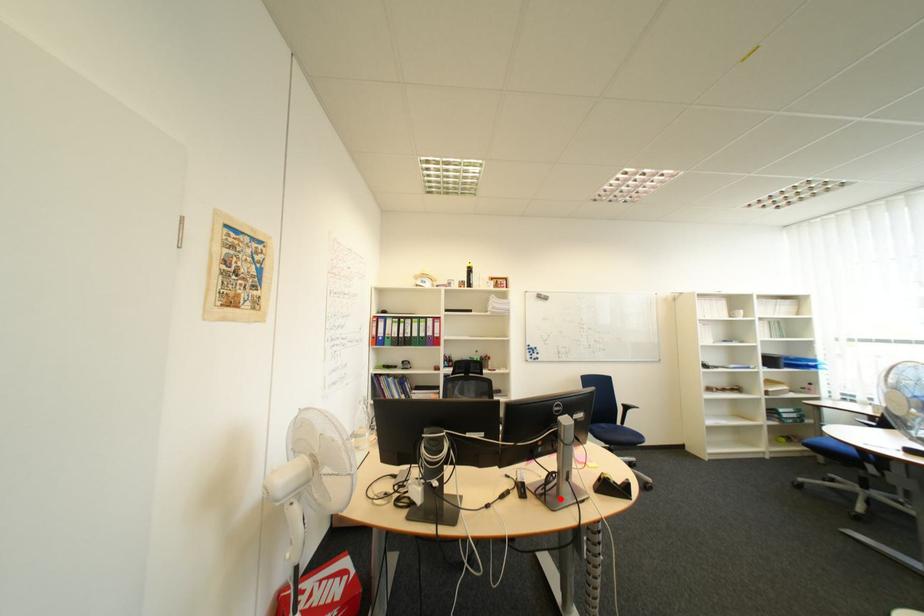
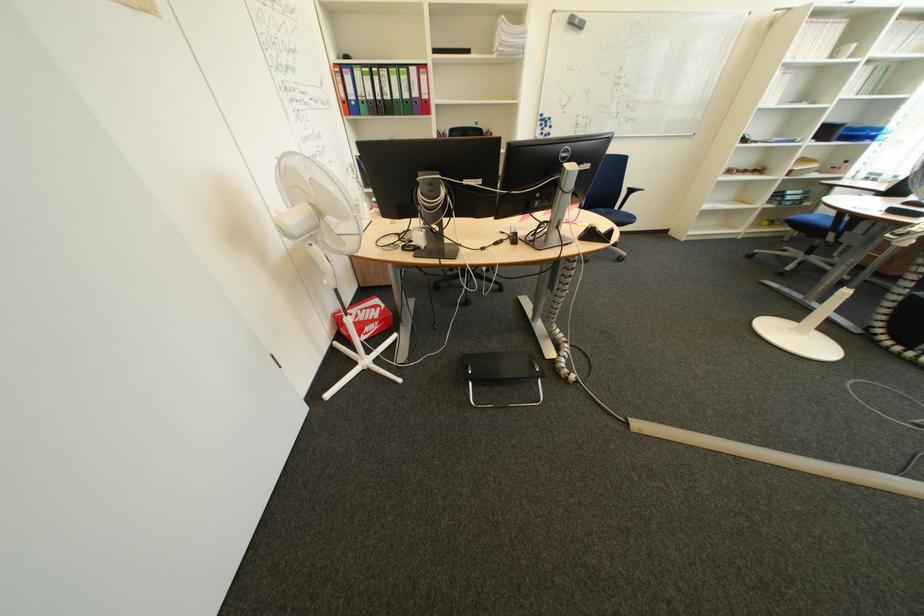
In the second image, find the point that corresponds to the highlighted location in the first image.

(549, 244)